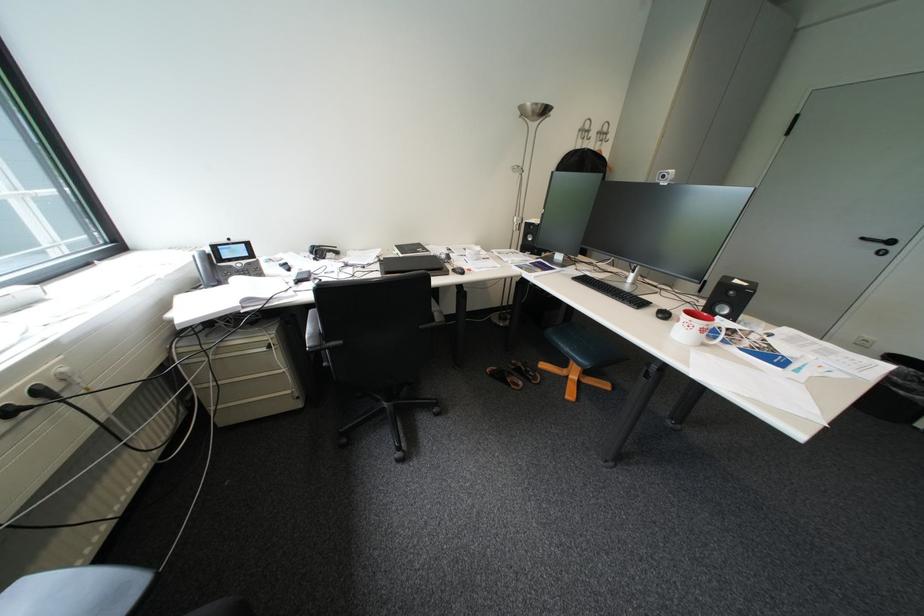
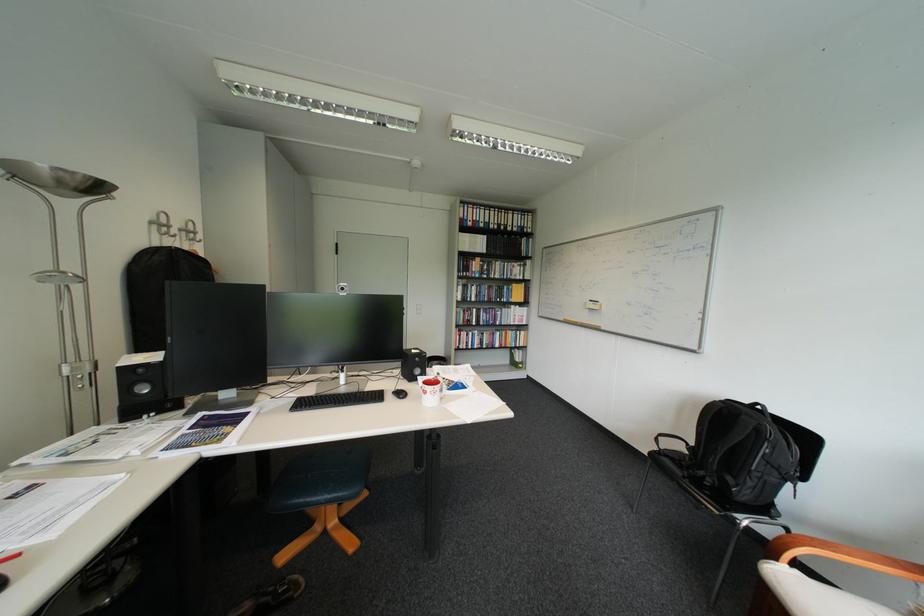
Find the pixel in the second image that matches the point at 602,140 in the first image.

(187, 237)